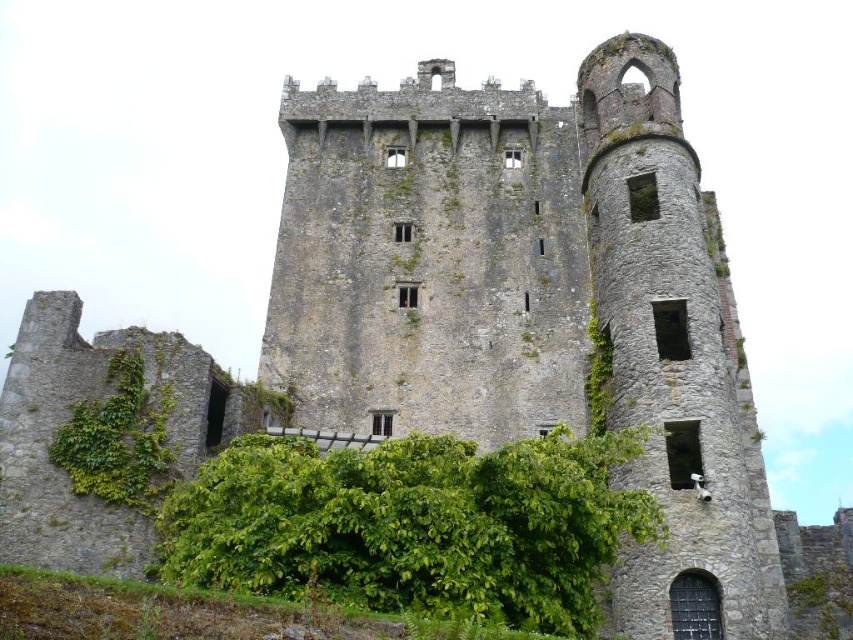
You are standing in front of the castle and notice two plants. One is the green leafy bush at lower center and the other is the green leafy ivy at lower left. Which plant is located more to the left?

The green leafy ivy at lower left is more to the left because the green leafy bush at lower center is positioned on the right side of it.

You are standing at the base of the castle and notice two points marked on the castle wall. One is at coordinates point (408,544) and the other at point (125,387). Which point is closer to you?

Point (408,544) is in front of point (125,387), so the point (408,544) is closer to you.

Based on the scene of the historic stone castle with its gray stones and weathered appearance, which object is taller between the green leafy bush at lower center and the green leafy ivy at lower left?

The green leafy bush at lower center is much taller than the green leafy ivy at lower left according to the description.